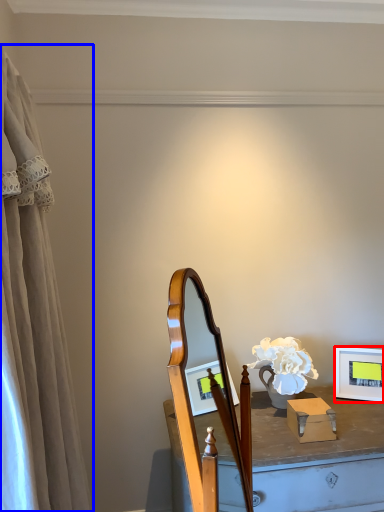
Question: Among these objects, which one is nearest to the camera, picture frame (highlighted by a red box) or curtain (highlighted by a blue box)?

Choices:
 (A) picture frame
 (B) curtain

Answer: (B)